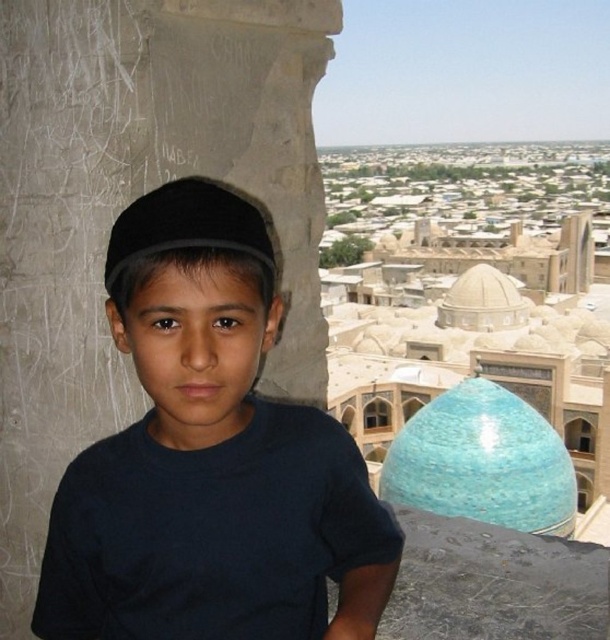
Question: Is dark blue t-shirt at center positioned in front of black fabric baseball hat at center?

Choices:
 (A) no
 (B) yes

Answer: (B)

Question: From the image, what is the correct spatial relationship of dark blue t-shirt at center in relation to black fabric baseball hat at center?

Choices:
 (A) below
 (B) above

Answer: (A)

Question: Which of the following is the closest to the observer?

Choices:
 (A) (274, 273)
 (B) (210, 248)

Answer: (B)

Question: Can you confirm if dark blue t-shirt at center is thinner than black fabric baseball hat at center?

Choices:
 (A) yes
 (B) no

Answer: (B)

Question: Which object appears farthest from the camera in this image?

Choices:
 (A) dark blue t-shirt at center
 (B) black fabric baseball hat at center

Answer: (B)